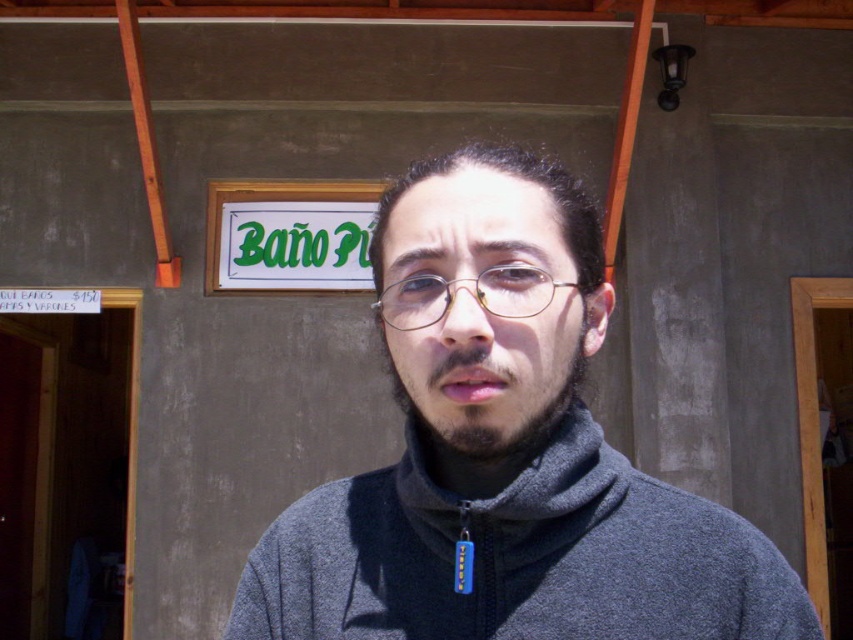
Question: Which of the following is the farthest from the observer?

Choices:
 (A) (419, 278)
 (B) (405, 173)

Answer: (B)

Question: Does gray fleece jacket at center have a greater width compared to dark brown stubble at center?

Choices:
 (A) no
 (B) yes

Answer: (B)

Question: Considering the real-world distances, which object is closest to the gray fleece jacket at center?

Choices:
 (A) gold metallic glasses at center
 (B) dark brown stubble at center

Answer: (B)

Question: Can you confirm if gray fleece jacket at center is positioned to the left of gold metallic glasses at center?

Choices:
 (A) no
 (B) yes

Answer: (A)

Question: Does gray fleece jacket at center come in front of gold metallic glasses at center?

Choices:
 (A) yes
 (B) no

Answer: (A)

Question: Which point is farther to the camera?

Choices:
 (A) (583, 428)
 (B) (444, 289)

Answer: (A)